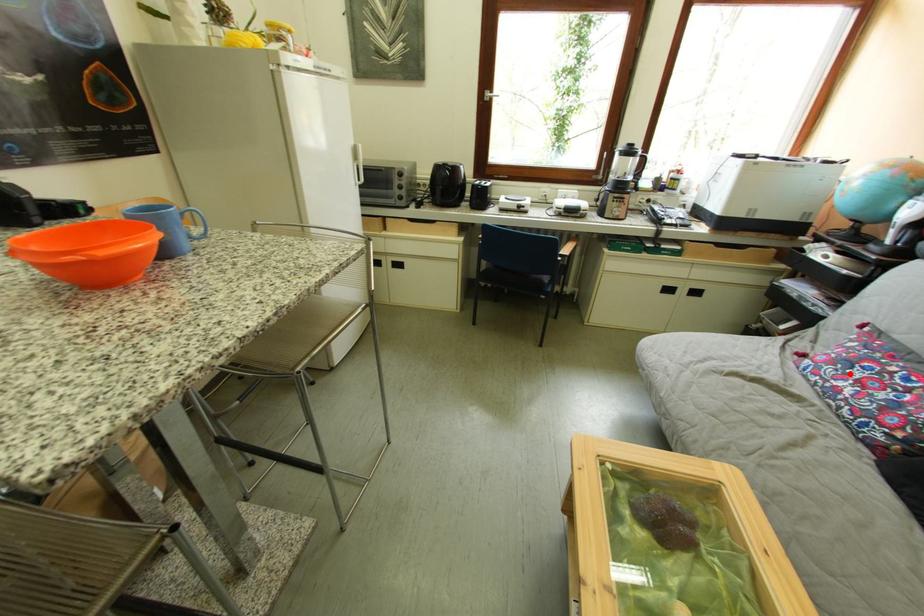
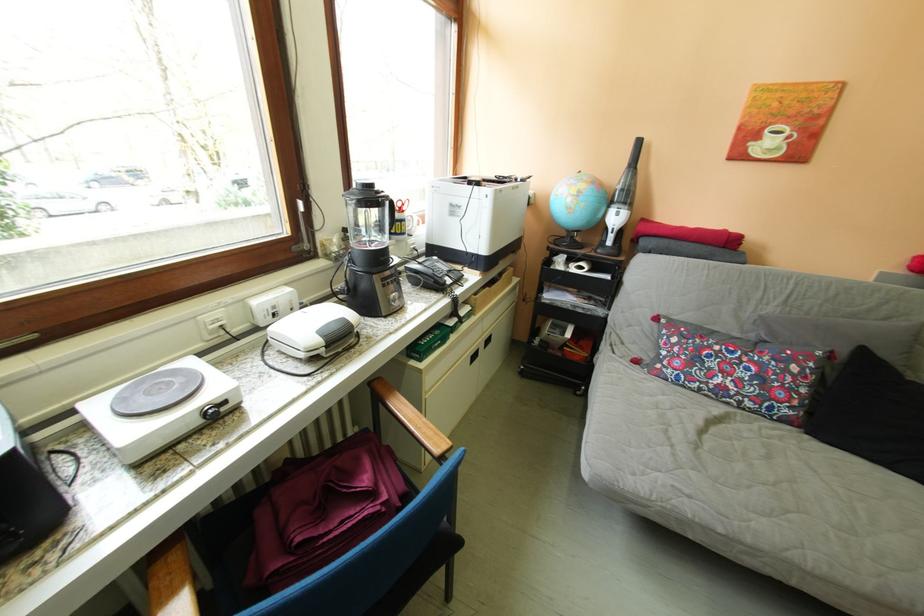
Question: I am providing you with two images of the same scene from different viewpoints. Given a red point in image1, look at the same physical point in image2. Is it:

Choices:
 (A) Closer to the viewpoint
 (B) Farther from the viewpoint

Answer: (A)